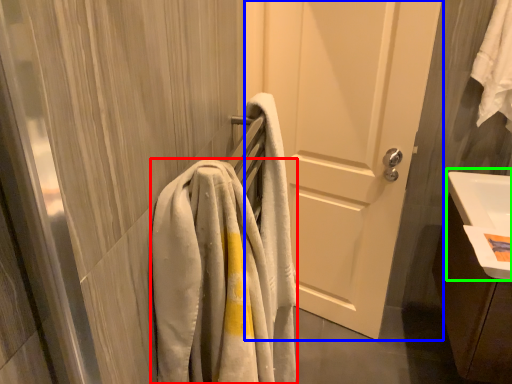
Question: Which is farther away from towel (highlighted by a red box)? door (highlighted by a blue box) or sink (highlighted by a green box)?

Choices:
 (A) door
 (B) sink

Answer: (A)